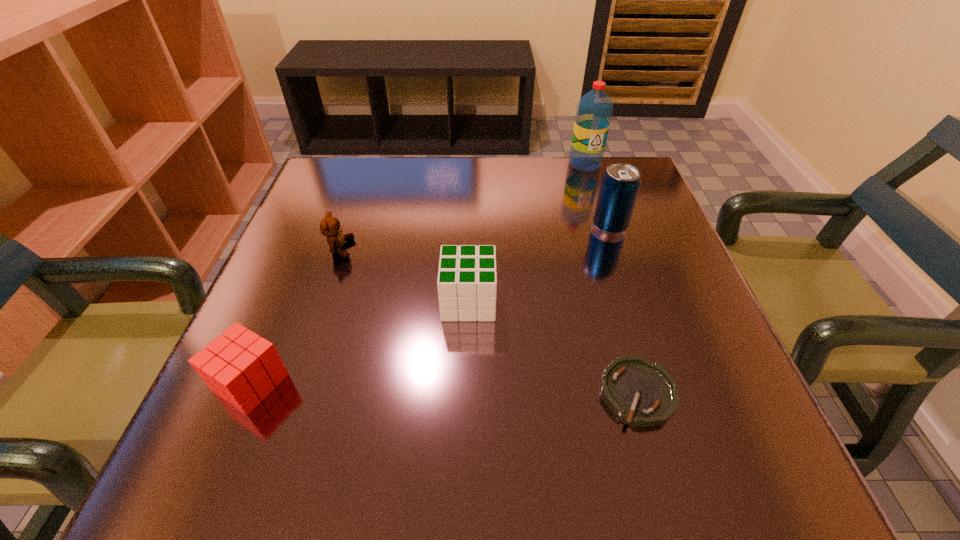
Find the location of a particular element. vacant space that satisfies the following two spatial constraints: 1. on the front side of the nearer cube; 2. on the right side of the shortest object is located at coordinates (247, 393).

The width and height of the screenshot is (960, 540). In order to click on free space that satisfies the following two spatial constraints: 1. on the front label of the tallest object; 2. on the front-facing side of the teddy bear in this screenshot , I will do `click(612, 248)`.